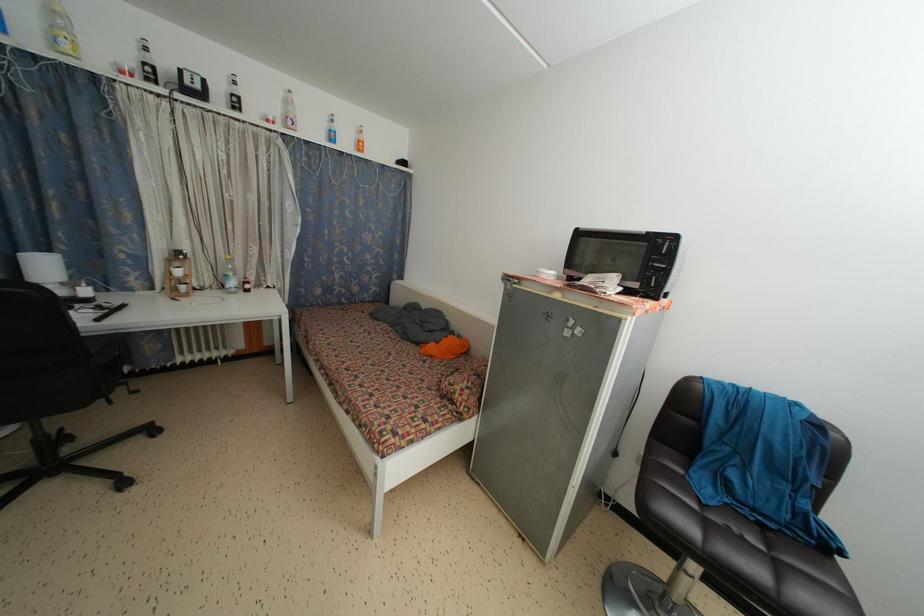
Describe the element at coordinates (674, 275) in the screenshot. I see `the microwave control knob` at that location.